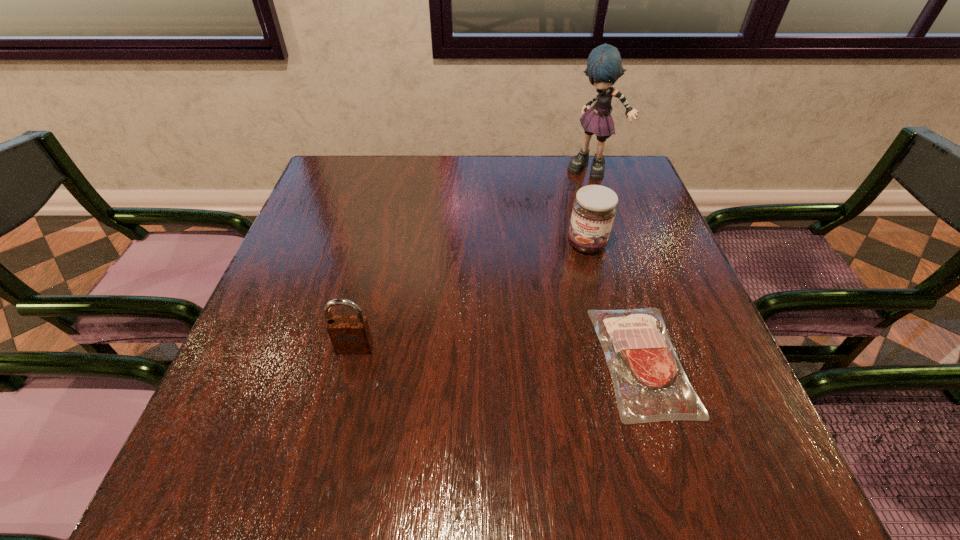
Where is `free location located on the front label of the jam`? The image size is (960, 540). free location located on the front label of the jam is located at coordinates (564, 293).

Where is `free space located 0.320m on the front label of the jam`? free space located 0.320m on the front label of the jam is located at coordinates (534, 360).

I want to click on vacant space situated 0.340m on the front label of the jam, so click(x=530, y=368).

The image size is (960, 540). I want to click on object that is positioned at the far edge, so click(604, 66).

This screenshot has height=540, width=960. In order to click on object at the near edge in this screenshot , I will do `click(650, 385)`.

Locate an element on the screen. Image resolution: width=960 pixels, height=540 pixels. steak that is at the right edge is located at coordinates (650, 385).

Locate an element on the screen. The height and width of the screenshot is (540, 960). rag doll that is at the right edge is located at coordinates (604, 66).

Locate an element on the screen. Image resolution: width=960 pixels, height=540 pixels. jam that is at the right edge is located at coordinates (594, 209).

This screenshot has width=960, height=540. Find the location of `object that is positioned at the far right corner`. object that is positioned at the far right corner is located at coordinates (604, 66).

Find the location of `object located at the near right corner`. object located at the near right corner is located at coordinates (650, 385).